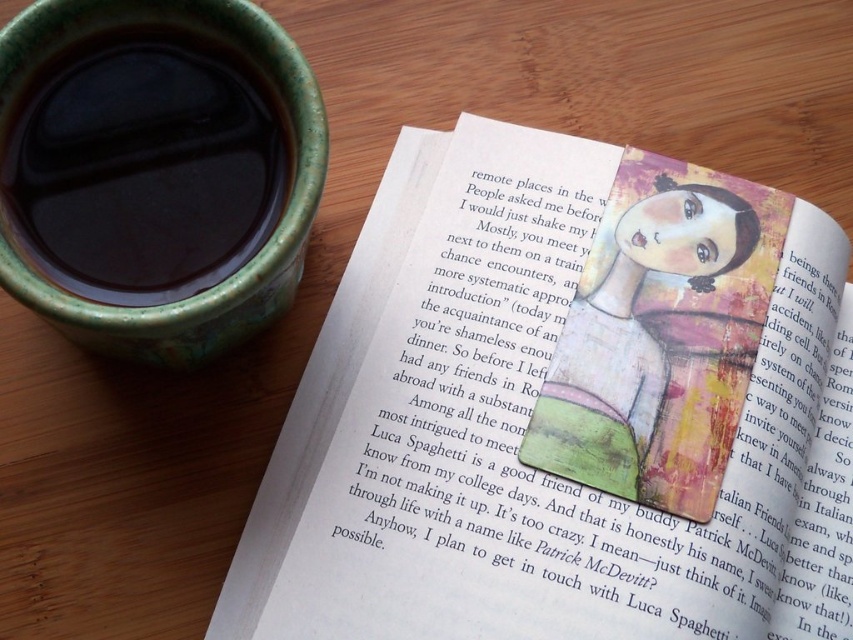
Does point (149, 208) lie behind point (712, 212)?

That is False.

Does matte green cup at upper left appear on the left side of matte painted doll at center?

Indeed, matte green cup at upper left is positioned on the left side of matte painted doll at center.

Who is more forward, [212,92] or [598,444]?

Point [212,92]

Locate an element on the screen. This screenshot has height=640, width=853. matte green cup at upper left is located at coordinates (143, 168).

Which is below, matte paper bookmark at center or matte painted doll at center?

matte paper bookmark at center is lower down.

Who is positioned more to the left, matte paper bookmark at center or matte painted doll at center?

matte paper bookmark at center is more to the left.

Is point (500, 241) less distant than point (721, 323)?

No.

The image size is (853, 640). I want to click on matte paper bookmark at center, so click(564, 410).

Between point (357, 397) and point (190, 180), which one is positioned behind?

The point (357, 397) is more distant.

Who is higher up, matte paper bookmark at center or matte green cup at upper left?

Positioned higher is matte green cup at upper left.

What are the coordinates of `matte paper bookmark at center` in the screenshot? It's located at (564, 410).